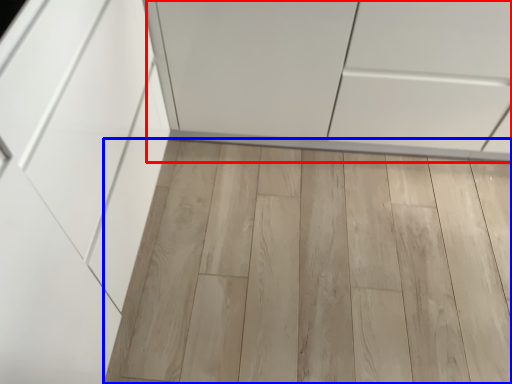
Question: Which point is closer to the camera, cabinetry (highlighted by a red box) or plank (highlighted by a blue box)?

Choices:
 (A) cabinetry
 (B) plank

Answer: (A)